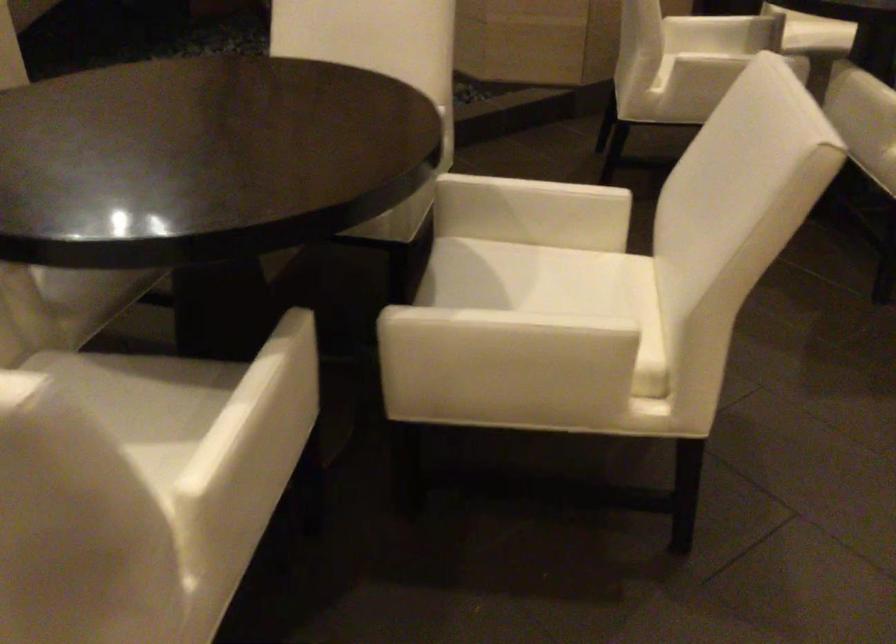
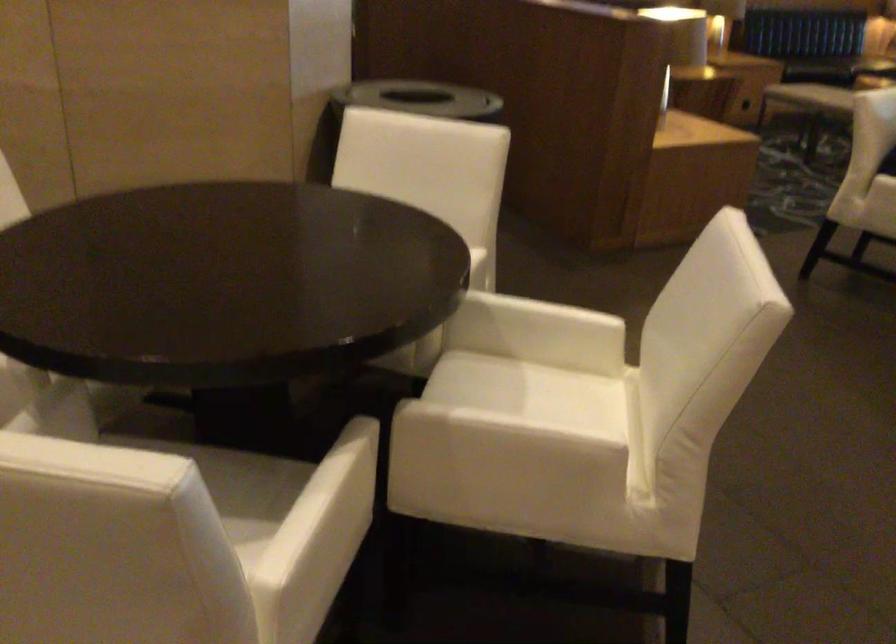
In a continuous first-person perspective shot, in which direction is the camera moving?

The cameraman moved toward right, forward.